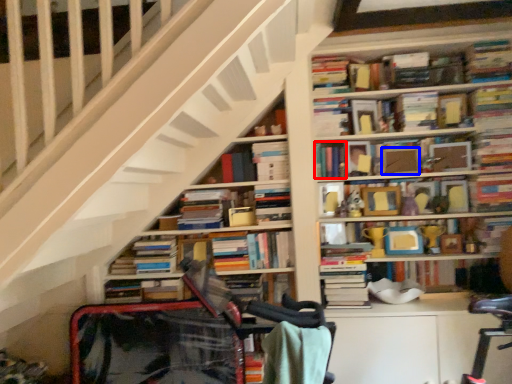
Question: Which of the following is the closest to the observer, book (highlighted by a red box) or paperback book (highlighted by a blue box)?

Choices:
 (A) book
 (B) paperback book

Answer: (A)